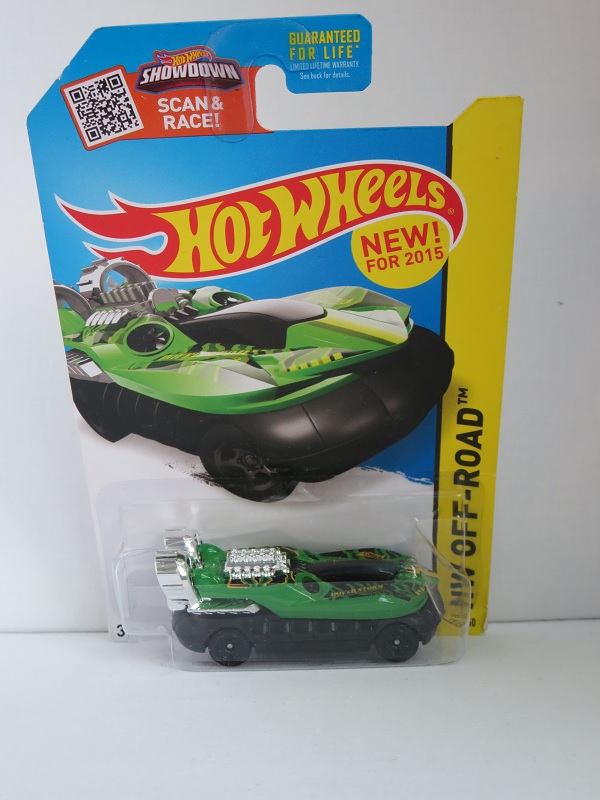
Where is `toy car`? toy car is located at coordinates (298, 406), (311, 606).